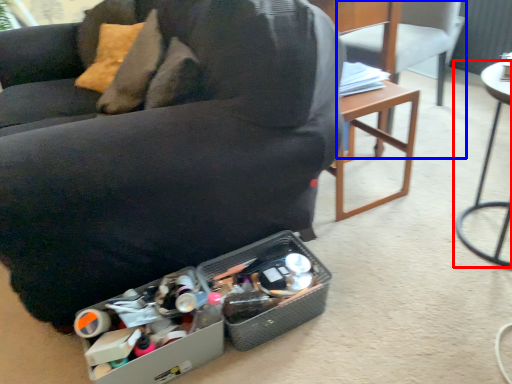
Question: Which object appears farthest to the camera in this image, table (highlighted by a red box) or chair (highlighted by a blue box)?

Choices:
 (A) table
 (B) chair

Answer: (B)